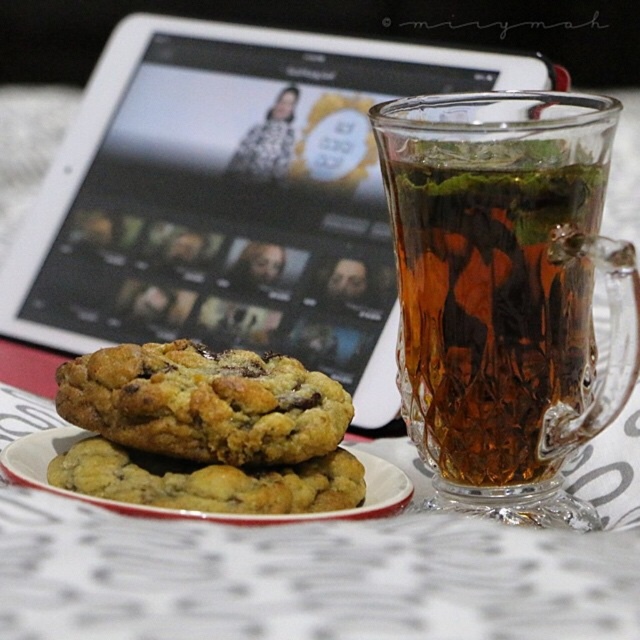
You are placing a brown glass cup on a table with coordinates. The center of the table is at point 0.5, 0.5. Is the brown glass cup at upper right closer to the table center than 0.3 units?

The brown glass cup at upper right is located at point (490, 298). The distance to the table center at (320, 320) is calculated using the distance formula sqrt of squared differences. The distance is sqrt of 0.034 squared plus 0.233 squared, which is approximately 0.236 units. Since 0.236 is less than 0.3, the cup is closer than 0.3 units to the table center.

You are a person sitting at a table and want to grab the brown glass cup at upper right. Which direction should you move your hand relative to the white ceramic plate at center?

You should move your hand to the right of the white ceramic plate at center to reach the brown glass cup at upper right.

From the picture: You are a barista trying to determine if the brown glass cup at upper right can hold the golden brown cookie with chocolate chips at center without overflowing. Can it fit?

The brown glass cup at upper right is much taller than the golden brown cookie with chocolate chips at center, so it can hold the cookie without overflowing.